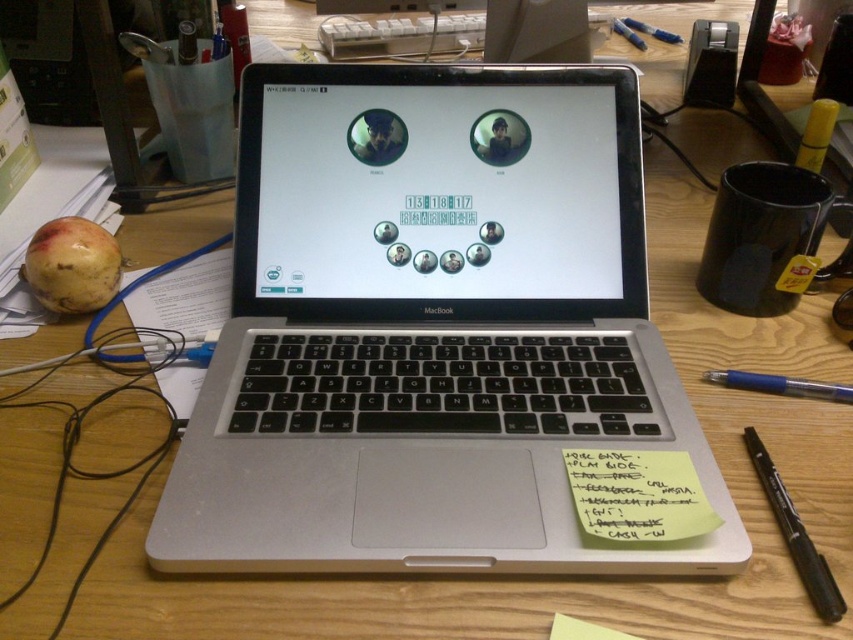
Between silver metallic laptop at center and yellow paper at lower right, which one is positioned lower?

Positioned lower is yellow paper at lower right.

The image size is (853, 640). I want to click on silver metallic laptop at center, so click(431, 330).

Locate an element on the screen. This screenshot has width=853, height=640. silver metallic laptop at center is located at coordinates (431, 330).

Does silver metallic laptop at center appear over ripe yellow apple at left?

Incorrect, silver metallic laptop at center is not positioned above ripe yellow apple at left.

Between silver metallic laptop at center and ripe yellow apple at left, which one has more height?

With more height is silver metallic laptop at center.

Locate an element on the screen. The width and height of the screenshot is (853, 640). silver metallic laptop at center is located at coordinates (431, 330).

Which of these two, ripe yellow apple at left or black plastic pen at lower right, stands shorter?

ripe yellow apple at left is shorter.

Which of these two, ripe yellow apple at left or black plastic pen at lower right, stands taller?

black plastic pen at lower right is taller.

Between point (94, 241) and point (822, 620), which one is positioned in front?

Point (822, 620) is in front.

The height and width of the screenshot is (640, 853). Find the location of `ripe yellow apple at left`. ripe yellow apple at left is located at coordinates (73, 266).